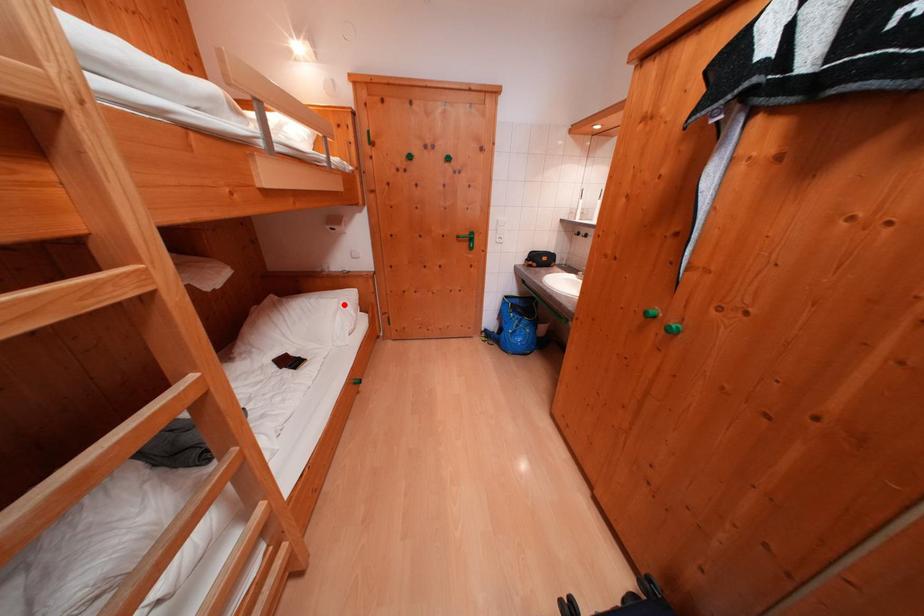
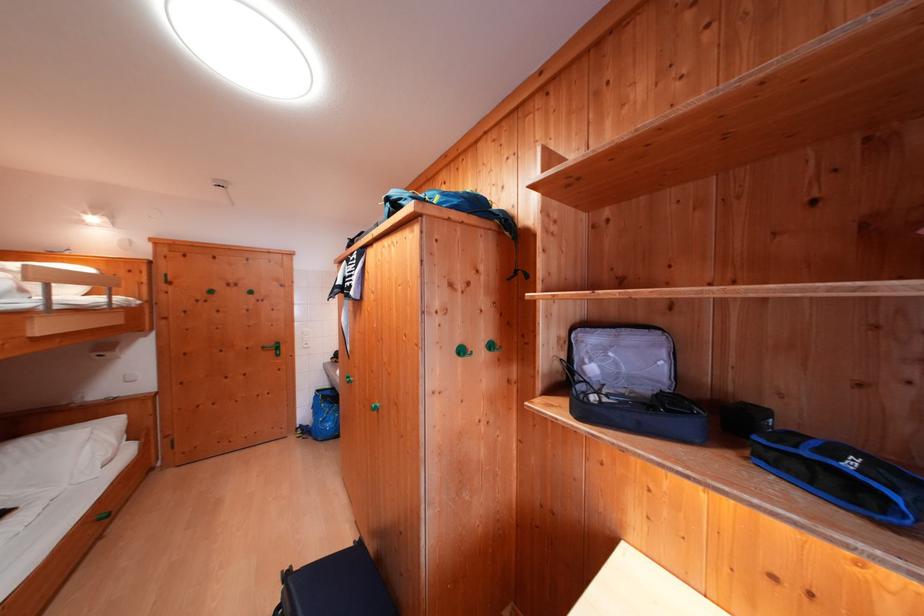
Question: A red point is marked in image1. In image2, is the corresponding 3D point closer to the camera or farther? Reply with the corresponding letter.

Choices:
 (A) The corresponding 3D point is closer.
 (B) The corresponding 3D point is farther.

Answer: (B)